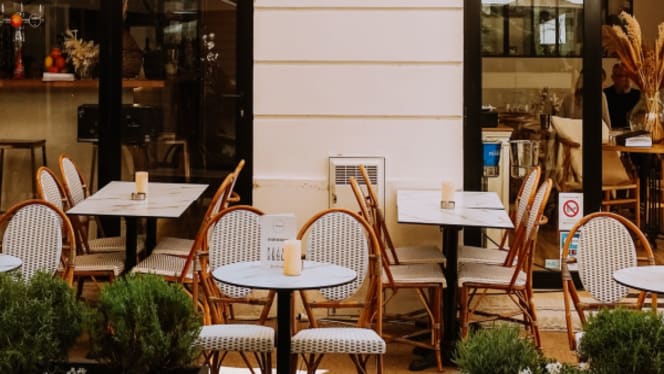
Find the location of a particular element. This screenshot has width=664, height=374. tables is located at coordinates (483, 223), (475, 202), (171, 201), (635, 281), (1, 270).